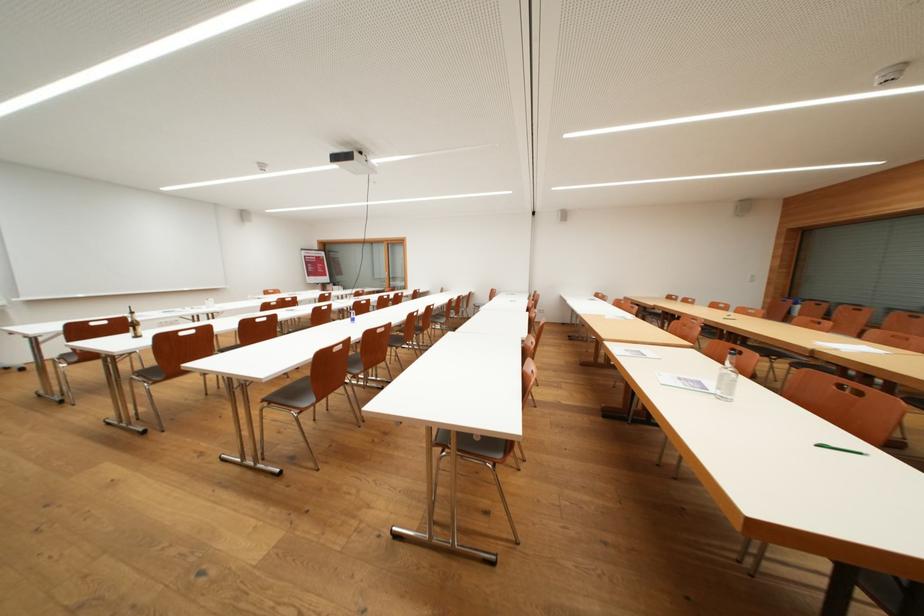
Which object does [726,378] point to?

It corresponds to the glass water bottle in the image.